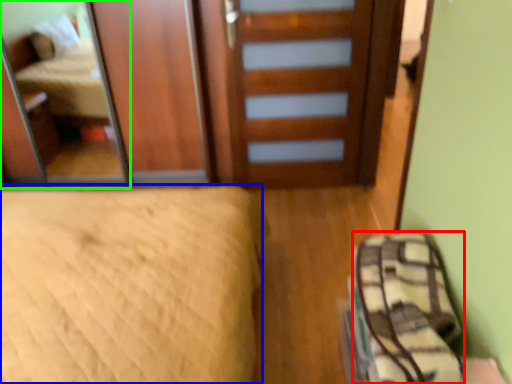
Question: Which is nearer to the material (highlighted by a red box)? bed (highlighted by a blue box) or mirror (highlighted by a green box).

Choices:
 (A) bed
 (B) mirror

Answer: (A)